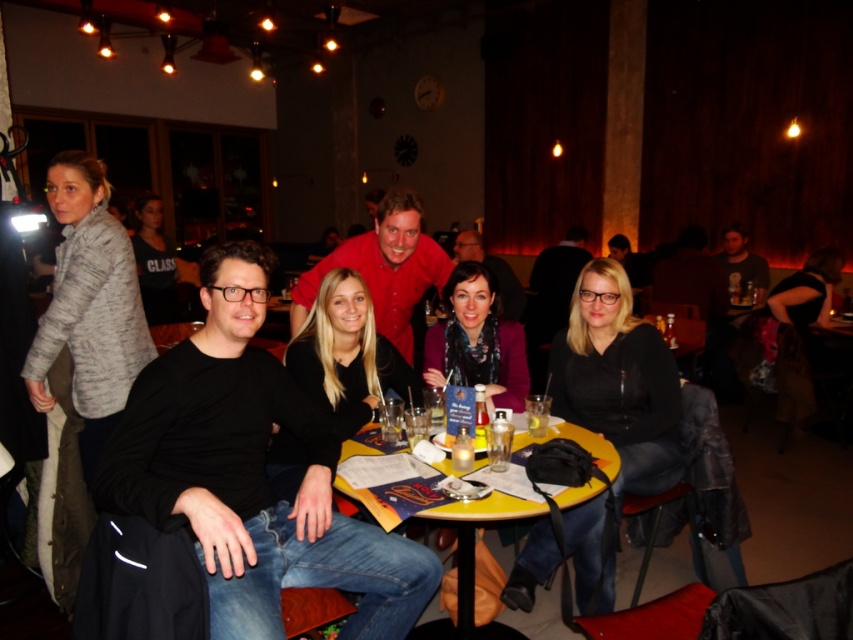
You are a server in a restaurant and need to place a 12 inch long plate on the table without it touching any items. Can you fit the plate between the yellowwoodentable at center and the clear plastic cup at table center?

The distance between the yellowwoodentable at center and the clear plastic cup at table center is 12.61 inches, which is slightly longer than the 12 inch plate. Therefore, the plate can be placed between them without touching either item.

What are the coordinates of the yellowwoodentable at center in the image?

The coordinates of the yellowwoodentable at center are at point (473, 541).

You are a waiter in a busy restaurant. You need to place a new order of drinks on the table without knocking over any items. Considering the yellowwoodentable at center and the clear plastic cup at table center, which object should you avoid placing drinks near to ensure stability?

The clear plastic cup at table center should be avoided when placing drinks near it because the yellowwoodentable at center is larger and can accommodate more space for stable placement.